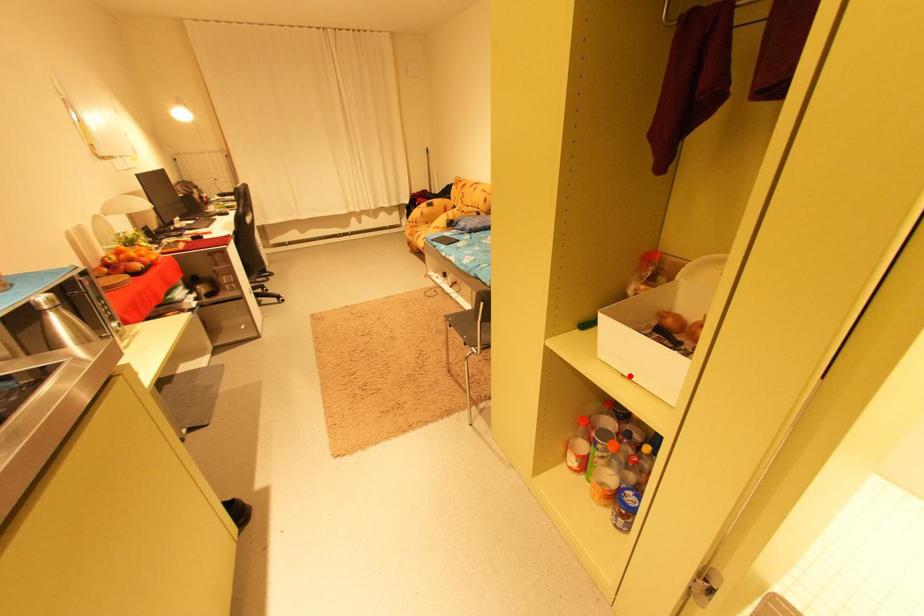
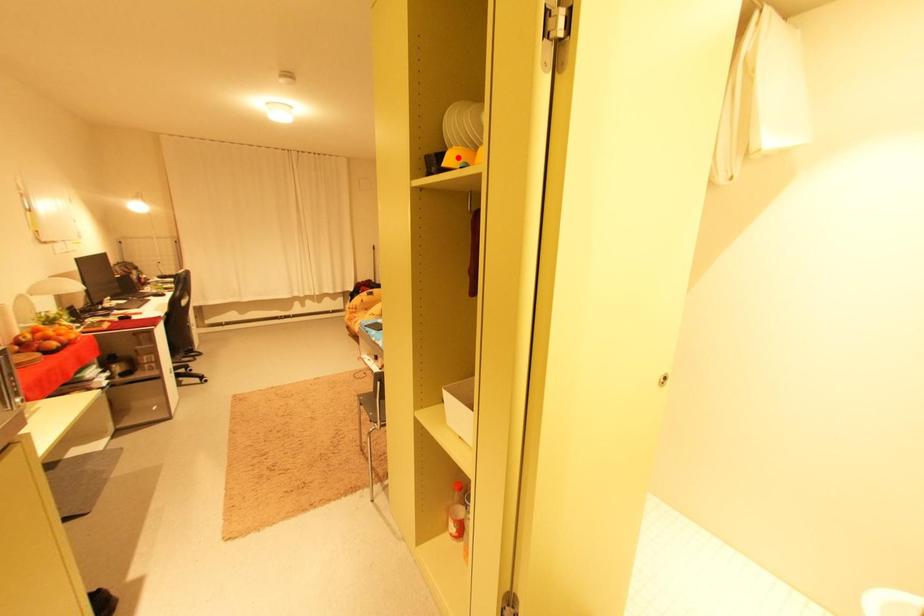
I am providing you with two images of the same scene from different viewpoints. A red point is marked on the first image and another point is marked on the second image. Is the red point in image1 aligned with the point shown in image2?

No